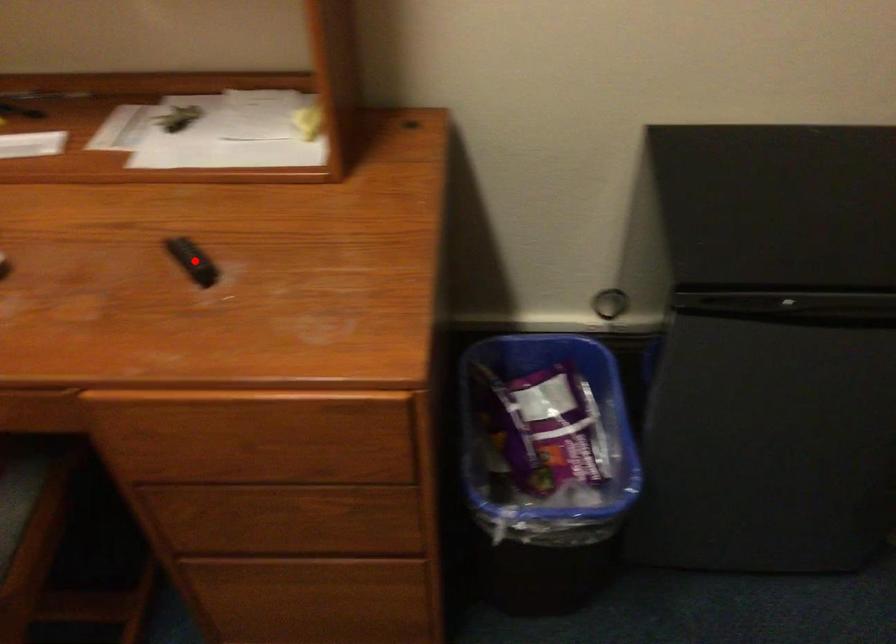
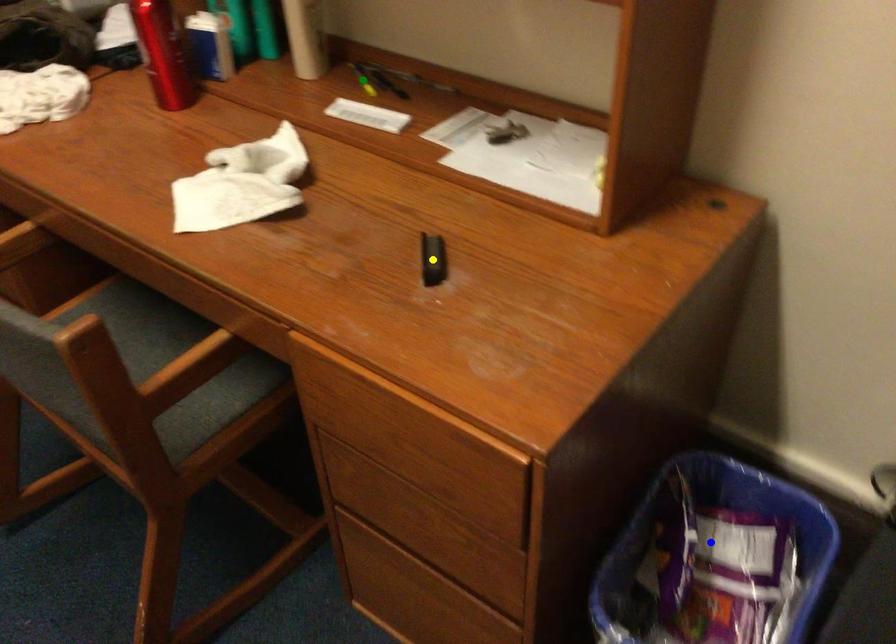
Question: I am providing you with two images of the same scene from different viewpoints. A red point is marked on the first image. You are given multiple points on the second image. Which mark in image 2 goes with the point in image 1?

Choices:
 (A) yellow point
 (B) blue point
 (C) green point

Answer: (A)